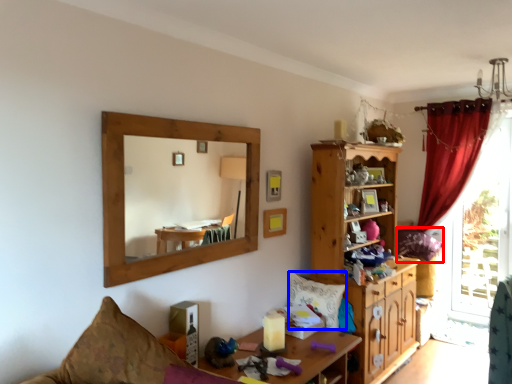
Question: Which point is further to the camera, pillow (highlighted by a red box) or pillow (highlighted by a blue box)?

Choices:
 (A) pillow
 (B) pillow

Answer: (A)